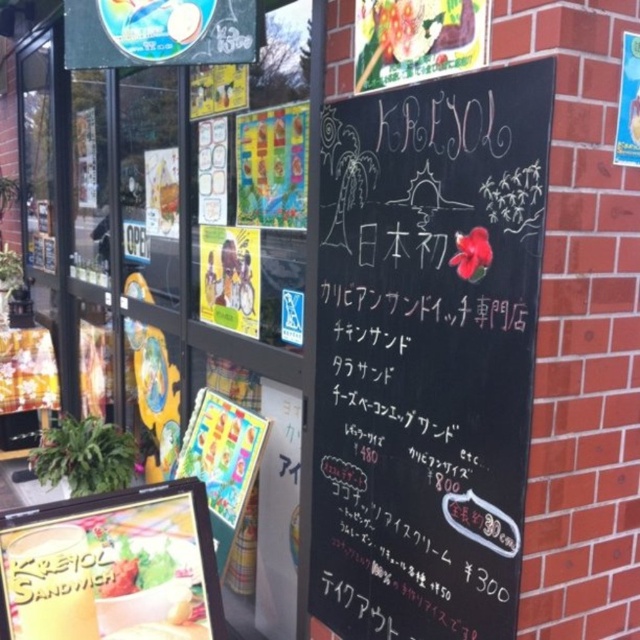
Question: Which point is closer to the camera?

Choices:
 (A) (440, 134)
 (B) (120, 557)

Answer: (A)

Question: Can you confirm if black chalkboard at center is positioned above green leafy salad at lower left?

Choices:
 (A) no
 (B) yes

Answer: (B)

Question: Is the position of black chalkboard at center more distant than that of green leafy salad at lower left?

Choices:
 (A) yes
 (B) no

Answer: (B)

Question: Which object appears farthest from the camera in this image?

Choices:
 (A) green leafy salad at lower left
 (B) black chalkboard at center

Answer: (A)

Question: Does black chalkboard at center appear on the right side of green leafy salad at lower left?

Choices:
 (A) yes
 (B) no

Answer: (A)

Question: Which point is farther to the camera?

Choices:
 (A) tap(141, 557)
 (B) tap(445, 225)

Answer: (A)